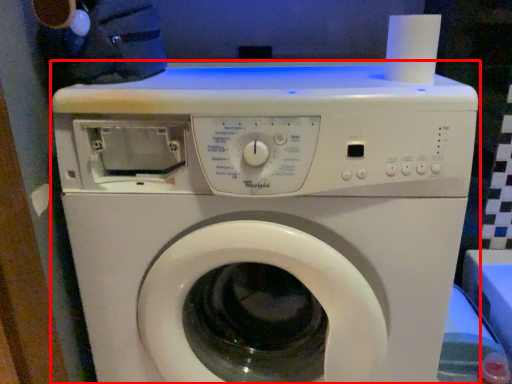
Question: Considering the relative positions of washing machine (annotated by the red box) and paper towel in the image provided, where is washing machine (annotated by the red box) located with respect to the staircase?

Choices:
 (A) right
 (B) left

Answer: (B)